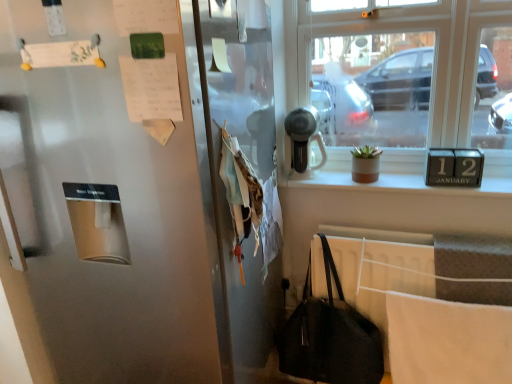
Measure the distance between point (x=55, y=60) and camera.

Point (x=55, y=60) is 36.69 inches from camera.

This screenshot has height=384, width=512. What do you see at coordinates (120, 218) in the screenshot? I see `satin silver refrigerator at left` at bounding box center [120, 218].

At what (x,y) coordinates should I click in order to perform the action: click on satin silver hairdryer at upper center. Please return your answer as a coordinate pair (x, y). The image size is (512, 384). Looking at the image, I should click on (302, 141).

Locate an element on the screen. The width and height of the screenshot is (512, 384). white paper at upper left, acting as the 2th paper starting from the top is located at coordinates (151, 88).

At what (x,y) coordinates should I click in order to perform the action: click on clear glass window at upper right. Please return your answer as a coordinate pair (x, y). The height and width of the screenshot is (384, 512). Looking at the image, I should click on (392, 29).

At what (x,y) coordinates should I click in order to perform the action: click on white matte paper at upper left, the second paper positioned from the right. Please return your answer as a coordinate pair (x, y). This screenshot has width=512, height=384. Looking at the image, I should click on (59, 54).

Is white matte paper at upper left, which is the second paper in bottom-to-top order, taller or shorter than white paper at upper left, which is the first paper in right-to-left order?

In the image, white matte paper at upper left, which is the second paper in bottom-to-top order, appears to be shorter than white paper at upper left, which is the first paper in right-to-left order.

Is white matte paper at upper left, the second paper positioned from the right, positioned before white paper at upper left, which is the second paper from left to right?

No, it is behind white paper at upper left, which is the second paper from left to right.

Is point (82, 61) closer to viewer compared to point (130, 95)?

No, (82, 61) is behind (130, 95).

Does satin silver hairdryer at upper center have a lesser width compared to clear glass window at upper right?

Yes, satin silver hairdryer at upper center is thinner than clear glass window at upper right.

Does satin silver hairdryer at upper center touch clear glass window at upper right?

There is a gap between satin silver hairdryer at upper center and clear glass window at upper right.

Which object is more forward, satin silver hairdryer at upper center or clear glass window at upper right?

clear glass window at upper right is in front.

Would you say satin silver hairdryer at upper center is to the left or to the right of clear glass window at upper right in the picture?

From the image, it's evident that satin silver hairdryer at upper center is to the left of clear glass window at upper right.

Is black leather handbag at lower right a part of clear glass window at upper right?

No, black leather handbag at lower right is not inside clear glass window at upper right.

How different are the orientations of clear glass window at upper right and black leather handbag at lower right in degrees?

6.01 degrees.

Where is `handbag located in front of the clear glass window at upper right`? handbag located in front of the clear glass window at upper right is located at coordinates (330, 337).

From the image's perspective, relative to black leather handbag at lower right, is clear glass window at upper right above or below?

Clearly, from the image's perspective, clear glass window at upper right is above black leather handbag at lower right.

What are the coordinates of `door that appears below the clear glass window at upper right (from the image's perspective)` in the screenshot? It's located at (120, 218).

Is clear glass window at upper right in front of or behind satin silver refrigerator at left in the image?

clear glass window at upper right is positioned farther from the viewer than satin silver refrigerator at left.

Choose the correct answer: Is clear glass window at upper right inside satin silver refrigerator at left or outside it?

clear glass window at upper right is outside satin silver refrigerator at left.

Is clear glass window at upper right facing towards satin silver refrigerator at left?

No, clear glass window at upper right is not turned towards satin silver refrigerator at left.

From the image's perspective, relative to clear glass window at upper right, is white matte paper at upper left, the second paper positioned from the right, above or below?

white matte paper at upper left, the second paper positioned from the right, is situated lower than clear glass window at upper right in the image.

Is white matte paper at upper left, which is the second paper in bottom-to-top order, in contact with clear glass window at upper right?

white matte paper at upper left, which is the second paper in bottom-to-top order, and clear glass window at upper right are clearly separated.

Considering the relative sizes of white matte paper at upper left, which is the second paper in bottom-to-top order, and clear glass window at upper right in the image provided, is white matte paper at upper left, which is the second paper in bottom-to-top order, thinner than clear glass window at upper right?

Correct, the width of white matte paper at upper left, which is the second paper in bottom-to-top order, is less than that of clear glass window at upper right.

Which is farther, (x=26, y=94) or (x=362, y=319)?

The point (x=362, y=319) is farther from the camera.

Would you say satin silver refrigerator at left is inside or outside black leather handbag at lower right?

The correct answer is: outside.

Consider the image. From a real-world perspective, between satin silver refrigerator at left and black leather handbag at lower right, who is vertically lower?

black leather handbag at lower right.

Looking at their sizes, would you say satin silver refrigerator at left is wider or thinner than black leather handbag at lower right?

In the image, satin silver refrigerator at left appears to be wider than black leather handbag at lower right.

Are black leather handbag at lower right and white paper at upper left, acting as the 2th paper starting from the top, making contact?

No, black leather handbag at lower right is not touching white paper at upper left, acting as the 2th paper starting from the top.

From the image's perspective, is black leather handbag at lower right above white paper at upper left, acting as the 2th paper starting from the top?

No, from the image's perspective, black leather handbag at lower right is not over white paper at upper left, acting as the 2th paper starting from the top.

From a real-world perspective, is black leather handbag at lower right under white paper at upper left, which is the first paper in right-to-left order?

Yes, from a real-world perspective, black leather handbag at lower right is under white paper at upper left, which is the first paper in right-to-left order.

Is white paper at upper left, which is the first paper in right-to-left order, completely or partially inside black leather handbag at lower right?

No, white paper at upper left, which is the first paper in right-to-left order, is located outside of black leather handbag at lower right.

The width and height of the screenshot is (512, 384). Identify the location of paper on the left of white paper at upper left, which is the second paper from left to right. (59, 54).

Where is `appliance below the clear glass window at upper right (from a real-world perspective)`? The height and width of the screenshot is (384, 512). appliance below the clear glass window at upper right (from a real-world perspective) is located at coordinates (302, 141).

Based on their spatial positions, is black leather handbag at lower right or white matte paper at upper left, which is counted as the 1th paper, starting from the left, further from satin silver refrigerator at left?

black leather handbag at lower right.

From the image, which object appears to be nearer to satin silver refrigerator at left, satin silver hairdryer at upper center or white matte paper at upper left, the second paper positioned from the right?

The object closer to satin silver refrigerator at left is white matte paper at upper left, the second paper positioned from the right.

When comparing their distances from white matte paper at upper left, the first paper when ordered from top to bottom, does satin silver hairdryer at upper center or black leather handbag at lower right seem closer?

satin silver hairdryer at upper center.

Considering their positions, is white paper at upper left, acting as the 2th paper starting from the top, positioned closer to satin silver refrigerator at left than black leather handbag at lower right?

white paper at upper left, acting as the 2th paper starting from the top.

Looking at this image, looking at the image, which one is located closer to white paper at upper left, acting as the 2th paper starting from the top, black leather handbag at lower right or white matte paper at upper left, the first paper when ordered from top to bottom?

white matte paper at upper left, the first paper when ordered from top to bottom.

Based on the photo, estimate the real-world distances between objects in this image. Which object is further from white paper at upper left, acting as the 2th paper starting from the top, satin silver hairdryer at upper center or white matte paper at upper left, which is counted as the 1th paper, starting from the left?

satin silver hairdryer at upper center is positioned further to the anchor white paper at upper left, acting as the 2th paper starting from the top.

Considering their positions, is clear glass window at upper right positioned closer to white matte paper at upper left, the second paper positioned from the right, than satin silver hairdryer at upper center?

The object closer to white matte paper at upper left, the second paper positioned from the right, is satin silver hairdryer at upper center.

Looking at the image, which one is located closer to satin silver hairdryer at upper center, satin silver refrigerator at left or clear glass window at upper right?

clear glass window at upper right is closer to satin silver hairdryer at upper center.

Identify the location of appliance situated between white paper at upper left, which is the second paper from left to right, and clear glass window at upper right from left to right. Image resolution: width=512 pixels, height=384 pixels. (302, 141).

Locate an element on the screen. appliance between white matte paper at upper left, the second paper positioned from the right, and clear glass window at upper right from left to right is located at coordinates (302, 141).

You are a GUI agent. You are given a task and a screenshot of the screen. Output one action in this format:
    pyautogui.click(x=<x>, y=<y>)
    Task: Click on the door between white matte paper at upper left, the second paper positioned from the right, and clear glass window at upper right, in the horizontal direction
    
    Given the screenshot: What is the action you would take?
    pyautogui.click(x=120, y=218)

Where is `window between satin silver refrigerator at left and satin silver hairdryer at upper center along the z-axis`? The image size is (512, 384). window between satin silver refrigerator at left and satin silver hairdryer at upper center along the z-axis is located at coordinates (392, 29).